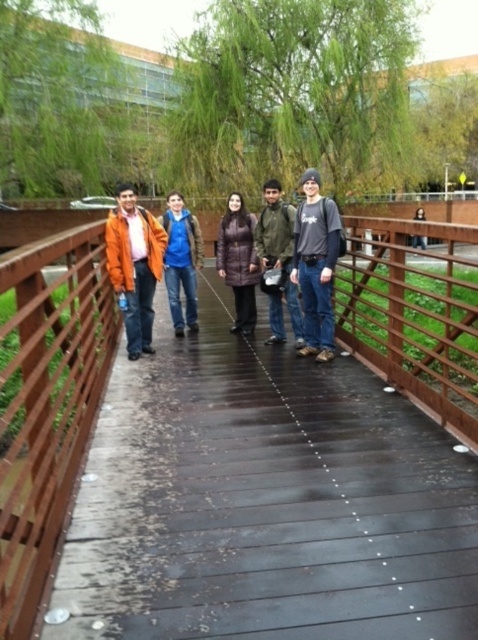
Does point (256, 259) come closer to viewer compared to point (415, 234)?

No, it is behind (415, 234).

Between point (246, 262) and point (414, 218), which one is positioned behind?

Positioned behind is point (414, 218).

Is point (243, 243) closer to viewer compared to point (424, 243)?

Yes, point (243, 243) is closer to viewer.

I want to click on matte purple coat at center, so click(x=239, y=260).

Based on the photo, does blue denim jeans at center have a larger size compared to matte black jacket at center?

Actually, blue denim jeans at center might be smaller than matte black jacket at center.

Can you confirm if blue denim jeans at center is positioned to the left of matte black jacket at center?

Correct, you'll find blue denim jeans at center to the left of matte black jacket at center.

Where is `blue denim jeans at center`? The width and height of the screenshot is (478, 640). blue denim jeans at center is located at coordinates (181, 260).

Identify the location of blue denim jeans at center. (181, 260).

Which is below, orange matte jacket at left or matte purple coat at center?

orange matte jacket at left

Measure the distance between point [126,324] and camera.

Point [126,324] is 17.44 feet away from camera.

Is point (138, 227) positioned in front of point (229, 221)?

Yes, it is in front of point (229, 221).

At what (x,y) coordinates should I click in order to perform the action: click on orange matte jacket at left. Please return your answer as a coordinate pair (x, y). Image resolution: width=478 pixels, height=640 pixels. Looking at the image, I should click on (134, 266).